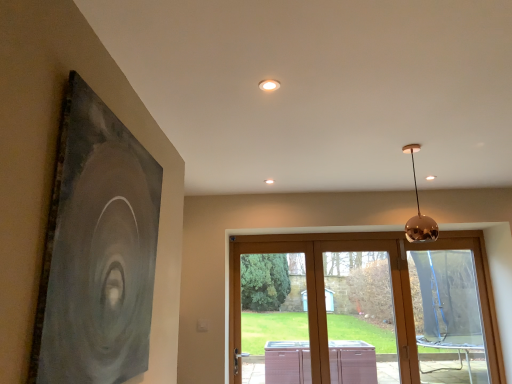
Question: Is wooden sliding door at center, arranged as the second window when viewed from the left, far from transparent plastic window at lower right, the third window positioned from the left?

Choices:
 (A) no
 (B) yes

Answer: (B)

Question: Does wooden sliding door at center, acting as the second window starting from the right, have a smaller size compared to transparent plastic window at lower right, which appears as the 1th window when viewed from the right?

Choices:
 (A) yes
 (B) no

Answer: (B)

Question: Is wooden sliding door at center, acting as the second window starting from the right, outside of transparent plastic window at lower right, which appears as the 1th window when viewed from the right?

Choices:
 (A) yes
 (B) no

Answer: (A)

Question: Is wooden sliding door at center, acting as the second window starting from the right, wider than transparent plastic window at lower right, the third window positioned from the left?

Choices:
 (A) no
 (B) yes

Answer: (B)

Question: Is the depth of wooden sliding door at center, acting as the second window starting from the right, greater than that of transparent plastic window at lower right, the third window positioned from the left?

Choices:
 (A) no
 (B) yes

Answer: (A)

Question: Is point (417, 241) closer or farther from the camera than point (117, 198)?

Choices:
 (A) closer
 (B) farther

Answer: (B)

Question: From a real-world perspective, relative to matte black painting at left, is polished copper sphere at upper right vertically above or below?

Choices:
 (A) below
 (B) above

Answer: (B)

Question: Would you say polished copper sphere at upper right is inside or outside matte black painting at left?

Choices:
 (A) inside
 (B) outside

Answer: (B)

Question: Is polished copper sphere at upper right to the left or to the right of matte black painting at left in the image?

Choices:
 (A) right
 (B) left

Answer: (A)

Question: Looking at their shapes, would you say wooden sliding door at center, acting as the second window starting from the right, is wider or thinner than transparent plastic window at lower right, the third window positioned from the left?

Choices:
 (A) thin
 (B) wide

Answer: (B)

Question: Is point (344, 349) positioned closer to the camera than point (437, 279)?

Choices:
 (A) closer
 (B) farther

Answer: (A)

Question: In the image, is wooden sliding door at center, acting as the second window starting from the right, positioned in front of or behind transparent plastic window at lower right, which appears as the 1th window when viewed from the right?

Choices:
 (A) behind
 (B) front

Answer: (B)

Question: Looking at the image, does wooden sliding door at center, acting as the second window starting from the right, seem bigger or smaller compared to transparent plastic window at lower right, which appears as the 1th window when viewed from the right?

Choices:
 (A) big
 (B) small

Answer: (A)

Question: In terms of size, does transparent plastic window at lower right, the third window positioned from the left, appear bigger or smaller than wooden sliding door at center, arranged as the second window when viewed from the left?

Choices:
 (A) big
 (B) small

Answer: (B)

Question: Relative to wooden sliding door at center, arranged as the second window when viewed from the left, is transparent plastic window at lower right, which appears as the 1th window when viewed from the right, in front or behind?

Choices:
 (A) front
 (B) behind

Answer: (B)